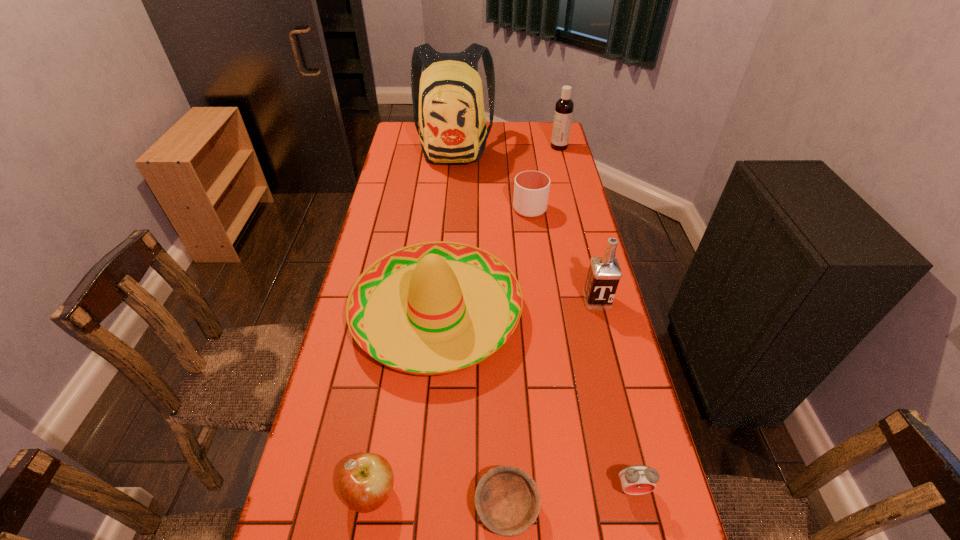
The width and height of the screenshot is (960, 540). Find the location of `free space at the right edge of the desktop`. free space at the right edge of the desktop is located at coordinates (589, 429).

This screenshot has width=960, height=540. I want to click on free point between the tallest object and the alarm clock, so click(x=543, y=319).

Locate an element on the screen. This screenshot has height=540, width=960. vacant area that lies between the vodka and the apple is located at coordinates (484, 397).

Identify the location of free spot between the backpack and the sombrero. (445, 231).

The image size is (960, 540). Find the location of `vacant area between the alarm clock and the cup`. vacant area between the alarm clock and the cup is located at coordinates (581, 349).

The height and width of the screenshot is (540, 960). Find the location of `free space that is in between the alarm clock and the cup`. free space that is in between the alarm clock and the cup is located at coordinates (581, 349).

Where is `free space between the vodka and the cup`? free space between the vodka and the cup is located at coordinates (564, 255).

Locate which object is the fifth closest to the cup. Please provide its 2D coordinates. Your answer should be formatted as a tuple, i.e. [(x, y)], where the tuple contains the x and y coordinates of a point satisfying the conditions above.

[(507, 500)]

In order to click on object that is the fifth nearest to the backpack in this screenshot , I will do `click(366, 480)`.

Image resolution: width=960 pixels, height=540 pixels. Identify the location of free spot that satisfies the following two spatial constraints: 1. on the front-facing side of the tallest object; 2. on the right side of the cup. (448, 209).